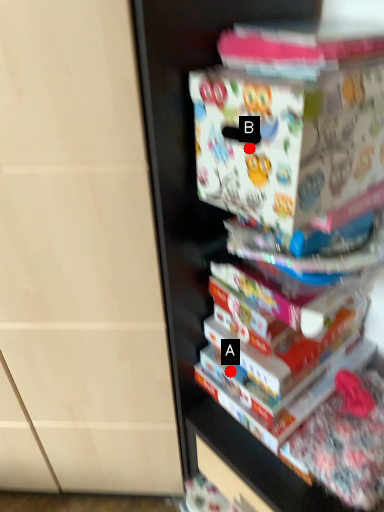
Question: Two points are circled on the image, labeled by A and B beside each circle. Which point is closer to the camera?

Choices:
 (A) A is closer
 (B) B is closer

Answer: (B)